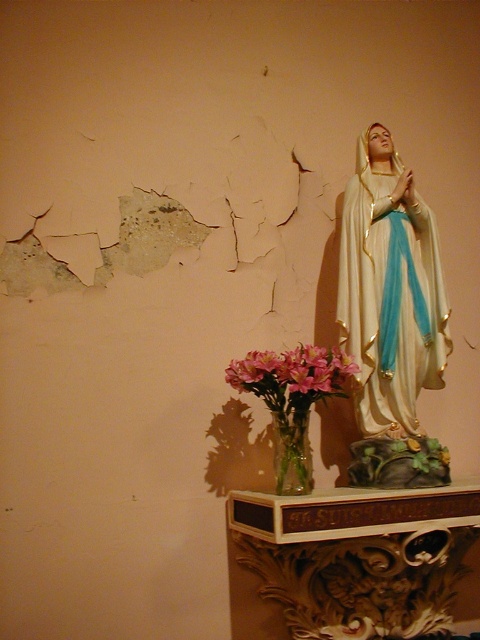
Question: Which point is closer to the camera taking this photo?

Choices:
 (A) (242, 360)
 (B) (400, 257)

Answer: (B)

Question: Among these objects, which one is farthest from the camera?

Choices:
 (A) clear glass vase at lower center
 (B) white glossy statue at upper right

Answer: (B)

Question: Does white glossy statue at upper right have a lesser width compared to pink glass vase at lower center?

Choices:
 (A) no
 (B) yes

Answer: (B)

Question: Does white glossy statue at upper right have a greater width compared to clear glass vase at lower center?

Choices:
 (A) no
 (B) yes

Answer: (B)

Question: Which point is farther to the camera?

Choices:
 (A) (383, 278)
 (B) (304, 433)
 (C) (250, 384)

Answer: (A)

Question: Can you confirm if white glossy statue at upper right is positioned above pink glass vase at lower center?

Choices:
 (A) yes
 (B) no

Answer: (A)